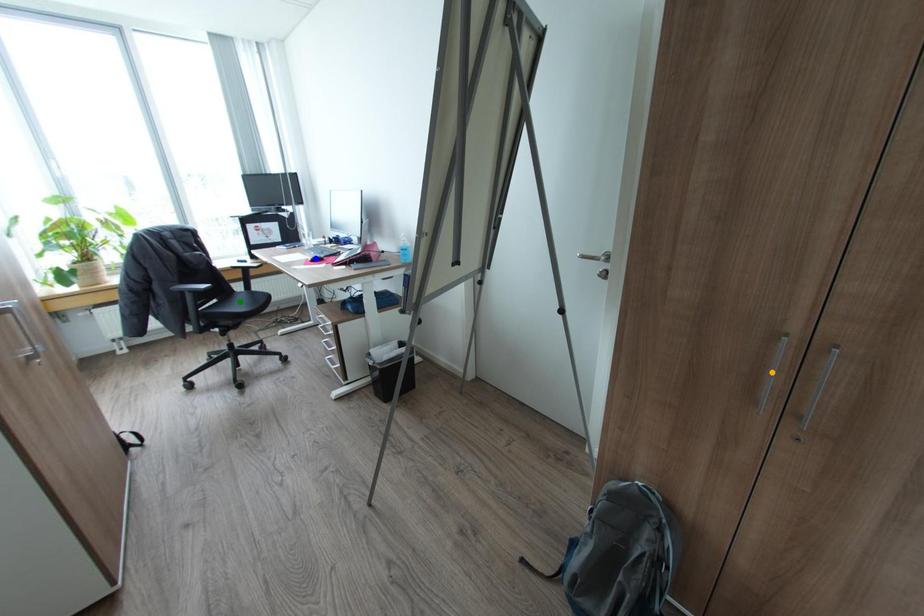
Order these from nearest to farthest:
orange point
green point
blue point

orange point
blue point
green point